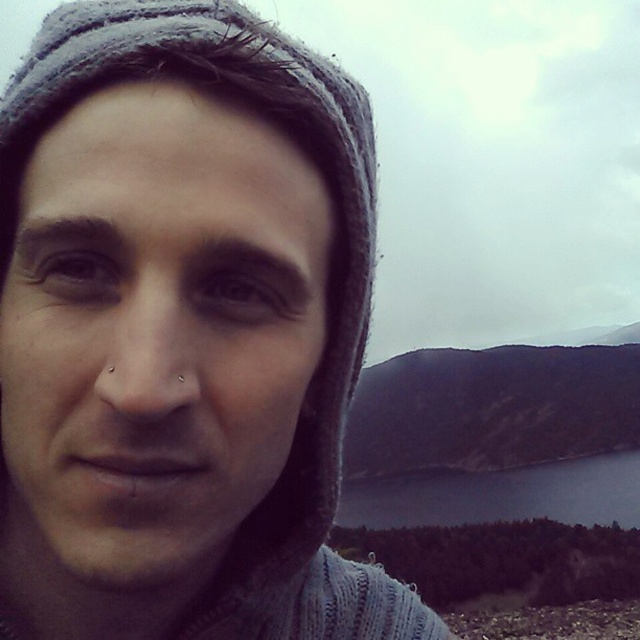
Question: Is matte gray knit cap at upper left thinner than dark blue water at lower center?

Choices:
 (A) no
 (B) yes

Answer: (B)

Question: Which object appears closest to the camera in this image?

Choices:
 (A) matte gray knit cap at upper left
 (B) dark blue water at lower center

Answer: (A)

Question: Can you confirm if matte gray knit cap at upper left is positioned to the left of dark blue water at lower center?

Choices:
 (A) yes
 (B) no

Answer: (A)

Question: Which point is farther to the camera?

Choices:
 (A) dark blue water at lower center
 (B) matte gray knit cap at upper left

Answer: (A)

Question: Is matte gray knit cap at upper left positioned in front of dark blue water at lower center?

Choices:
 (A) yes
 (B) no

Answer: (A)